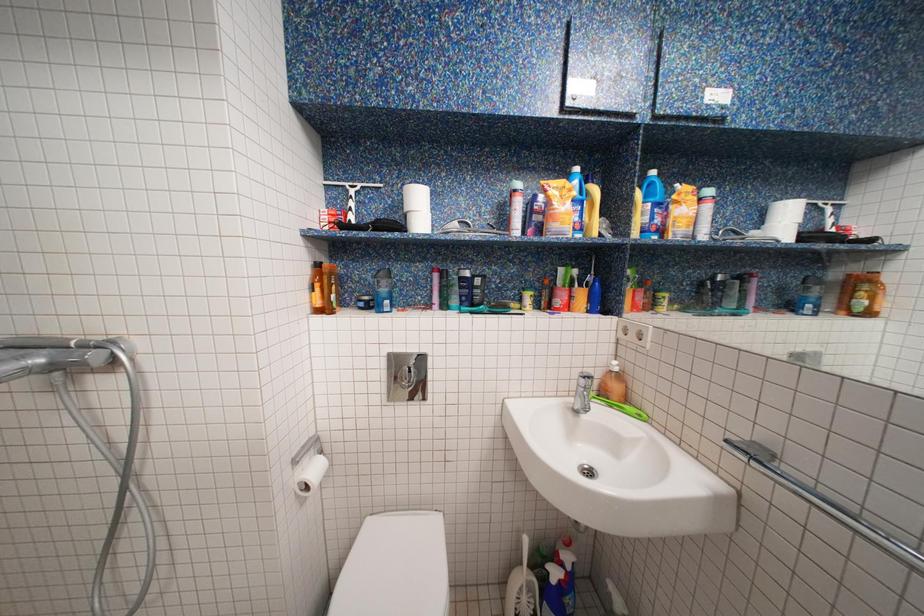
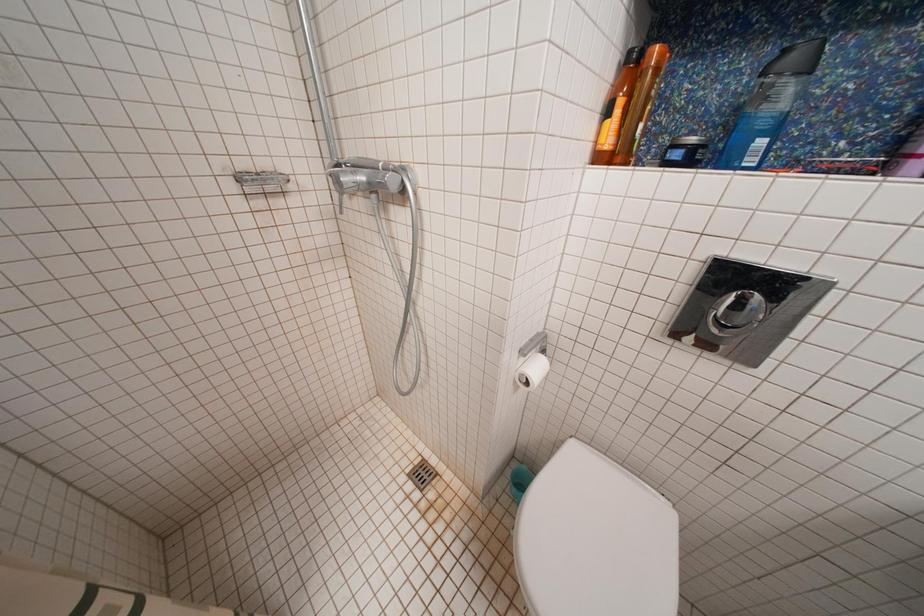
Based on the photo, the images are taken continuously from a first-person perspective. In which direction is your viewpoint rotating?

The camera's rotation is toward left-down.